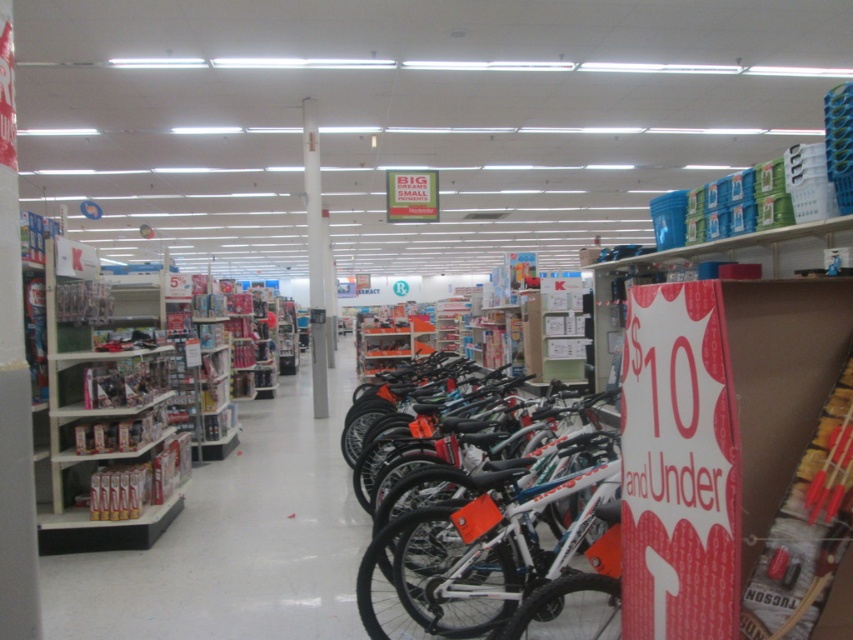
Is white smooth pillar at center below white glossy pillar at center?

Correct, white smooth pillar at center is located below white glossy pillar at center.

Between white smooth pillar at center and white glossy pillar at center, which one has less height?

white smooth pillar at center is shorter.

This screenshot has width=853, height=640. Describe the element at coordinates (13, 384) in the screenshot. I see `white smooth pillar at center` at that location.

Where is `white smooth pillar at center`? Image resolution: width=853 pixels, height=640 pixels. white smooth pillar at center is located at coordinates (13, 384).

Is point (590, 518) behind point (9, 141)?

That is True.

Does white matte bicycle at center have a lesser height compared to white smooth pillar at center?

Yes, white matte bicycle at center is shorter than white smooth pillar at center.

Who is more distant from viewer, (526, 532) or (16, 490)?

The point (526, 532) is behind.

Where is `white matte bicycle at center`? white matte bicycle at center is located at coordinates (466, 548).

Is point (564, 536) positioned in front of point (323, 259)?

That is True.

Between point (500, 577) and point (310, 216), which one is positioned behind?

Positioned behind is point (310, 216).

This screenshot has height=640, width=853. I want to click on white matte bicycle at center, so click(466, 548).